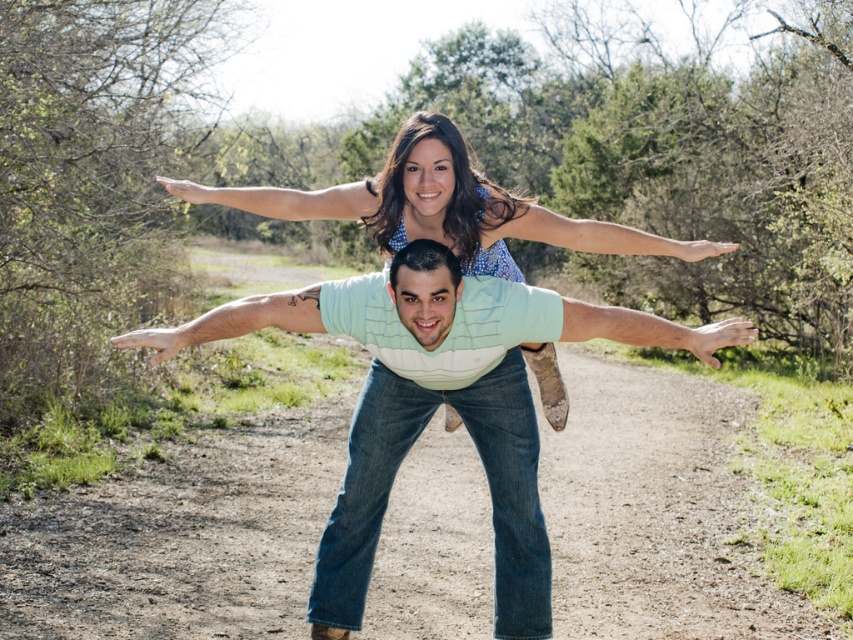
Is brown dirt track at center positioned in front of light blue denim jeans at center?

No, it is not.

This screenshot has width=853, height=640. What are the coordinates of `brown dirt track at center` in the screenshot? It's located at (181, 536).

This screenshot has width=853, height=640. Find the location of `brown dirt track at center`. brown dirt track at center is located at coordinates (181, 536).